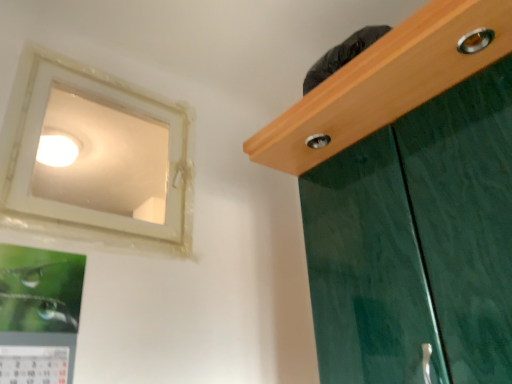
What do you see at coordinates (39, 314) in the screenshot? I see `metallic silver picture frame at lower left` at bounding box center [39, 314].

What are the coordinates of `metallic silver picture frame at lower left` in the screenshot? It's located at 39,314.

What do you see at coordinates (56, 150) in the screenshot? I see `white glossy light fixture at upper left` at bounding box center [56, 150].

The height and width of the screenshot is (384, 512). I want to click on white glossy light fixture at upper left, so pyautogui.click(x=56, y=150).

Identify the location of metallic silver picture frame at lower left. (39, 314).

Identify the location of window lying above the metallic silver picture frame at lower left (from the image's perspective). This screenshot has height=384, width=512. (96, 158).

Is metallic silver picture frame at lower left turned away from white plastic window at upper left?

No, metallic silver picture frame at lower left is not facing the opposite direction of white plastic window at upper left.

Does metallic silver picture frame at lower left appear on the left side of white plastic window at upper left?

Yes.

What's the angular difference between metallic silver picture frame at lower left and white plastic window at upper left's facing directions?

0.00248 degrees.

Can you confirm if white plastic window at upper left is bigger than white glossy light fixture at upper left?

Yes.

At what (x,y) coordinates should I click in order to perform the action: click on window below the white glossy light fixture at upper left (from a real-world perspective). Please return your answer as a coordinate pair (x, y). This screenshot has width=512, height=384. Looking at the image, I should click on (96, 158).

Is there a large distance between white plastic window at upper left and white glossy light fixture at upper left?

No, there isn't a large distance between white plastic window at upper left and white glossy light fixture at upper left.

Is white glossy light fixture at upper left a part of white plastic window at upper left?

No.

Is metallic silver picture frame at lower left further to camera compared to white glossy light fixture at upper left?

No, metallic silver picture frame at lower left is closer to the viewer.

There is a metallic silver picture frame at lower left. At what (x,y) coordinates should I click in order to perform the action: click on lighting above it (from a real-world perspective). Please return your answer as a coordinate pair (x, y). The image size is (512, 384). Looking at the image, I should click on (56, 150).

From a real-world perspective, is metallic silver picture frame at lower left under white glossy light fixture at upper left?

Correct, in the physical world, metallic silver picture frame at lower left is lower than white glossy light fixture at upper left.

Based on the photo, is metallic silver picture frame at lower left oriented away from white glossy light fixture at upper left?

No.

Does white glossy light fixture at upper left have a lesser width compared to metallic silver picture frame at lower left?

No, white glossy light fixture at upper left is not thinner than metallic silver picture frame at lower left.

Considering the positions of objects white glossy light fixture at upper left and metallic silver picture frame at lower left in the image provided, who is behind, white glossy light fixture at upper left or metallic silver picture frame at lower left?

white glossy light fixture at upper left is further away from the camera.

From a real-world perspective, is white glossy light fixture at upper left on metallic silver picture frame at lower left?

Yes, from a real-world perspective, white glossy light fixture at upper left is on top of metallic silver picture frame at lower left.

Can you confirm if white glossy light fixture at upper left is shorter than metallic silver picture frame at lower left?

Correct, white glossy light fixture at upper left is not as tall as metallic silver picture frame at lower left.

Is white plastic window at upper left inside the boundaries of metallic silver picture frame at lower left, or outside?

white plastic window at upper left exists outside the volume of metallic silver picture frame at lower left.

Is white plastic window at upper left looking in the opposite direction of metallic silver picture frame at lower left?

No, white plastic window at upper left is not facing the opposite direction of metallic silver picture frame at lower left.

Considering the relative sizes of white plastic window at upper left and metallic silver picture frame at lower left in the image provided, is white plastic window at upper left shorter than metallic silver picture frame at lower left?

No.

Image resolution: width=512 pixels, height=384 pixels. Find the location of `lighting above the white plastic window at upper left (from the image's perspective)`. lighting above the white plastic window at upper left (from the image's perspective) is located at coordinates (56, 150).

Is white glossy light fixture at upper left next to white plastic window at upper left?

No, white glossy light fixture at upper left is not in contact with white plastic window at upper left.

Considering the relative positions of white glossy light fixture at upper left and white plastic window at upper left in the image provided, is white glossy light fixture at upper left to the left or to the right of white plastic window at upper left?

In the image, white glossy light fixture at upper left appears on the left side of white plastic window at upper left.

Looking at this image, can you tell me how much white glossy light fixture at upper left and white plastic window at upper left differ in facing direction?

They differ by 89.9 degrees in their facing directions.

Locate an element on the screen. The height and width of the screenshot is (384, 512). window that appears behind the metallic silver picture frame at lower left is located at coordinates (96, 158).

Find the location of `window in front of the white glossy light fixture at upper left`. window in front of the white glossy light fixture at upper left is located at coordinates (96, 158).

Estimate the real-world distances between objects in this image. Which object is further from metallic silver picture frame at lower left, white glossy light fixture at upper left or white plastic window at upper left?

white glossy light fixture at upper left.

When comparing their distances from white plastic window at upper left, does metallic silver picture frame at lower left or white glossy light fixture at upper left seem closer?

Based on the image, white glossy light fixture at upper left appears to be nearer to white plastic window at upper left.

When comparing their distances from white plastic window at upper left, does white glossy light fixture at upper left or metallic silver picture frame at lower left seem closer?

white glossy light fixture at upper left.

Based on their spatial positions, is white plastic window at upper left or metallic silver picture frame at lower left further from white glossy light fixture at upper left?

Based on the image, metallic silver picture frame at lower left appears to be further to white glossy light fixture at upper left.

Estimate the real-world distances between objects in this image. Which object is further from metallic silver picture frame at lower left, white plastic window at upper left or white glossy light fixture at upper left?

white glossy light fixture at upper left is positioned further to the anchor metallic silver picture frame at lower left.

When comparing their distances from white glossy light fixture at upper left, does metallic silver picture frame at lower left or white plastic window at upper left seem closer?

white plastic window at upper left.

I want to click on window between metallic silver picture frame at lower left and white glossy light fixture at upper left in the front-back direction, so click(96, 158).